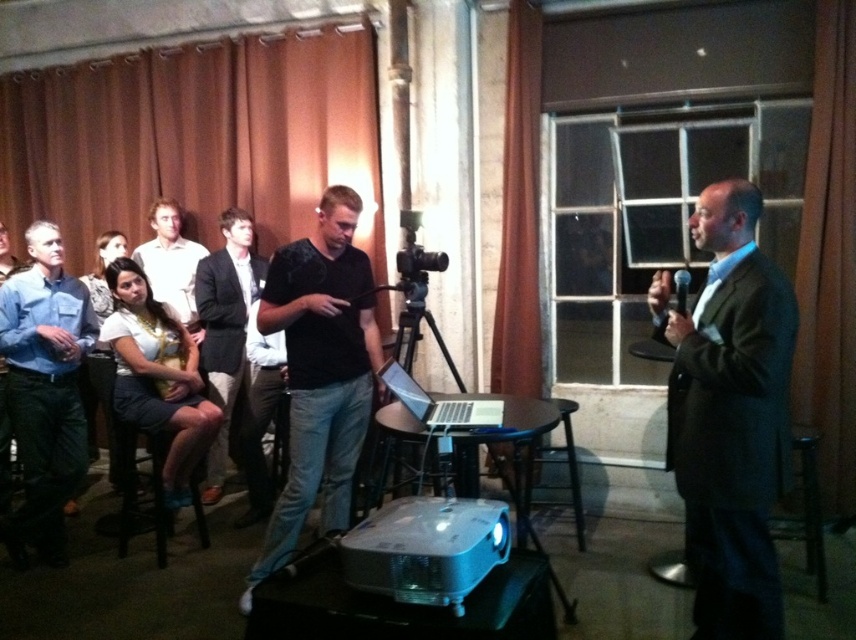
Question: Does black matte shirt at center have a larger size compared to brown fabric curtain at center?

Choices:
 (A) yes
 (B) no

Answer: (A)

Question: Which object appears farthest from the camera in this image?

Choices:
 (A) white plastic projector at center
 (B) black matte shirt at center
 (C) light brown shirt at center
 (D) brown fabric curtain at right

Answer: (C)

Question: Which object is the closest to the light brown shirt at center?

Choices:
 (A) black cotton shirt at center
 (B) black plastic microphone at upper right

Answer: (A)

Question: Is the position of brown fabric curtain at right more distant than that of white plastic projector at center?

Choices:
 (A) yes
 (B) no

Answer: (A)

Question: Among these points, which one is nearest to the camera?

Choices:
 (A) (413, 518)
 (B) (518, 45)
 (C) (340, 204)

Answer: (A)

Question: Does brown fabric curtain at center appear on the left side of black plastic video camera at center?

Choices:
 (A) yes
 (B) no

Answer: (B)